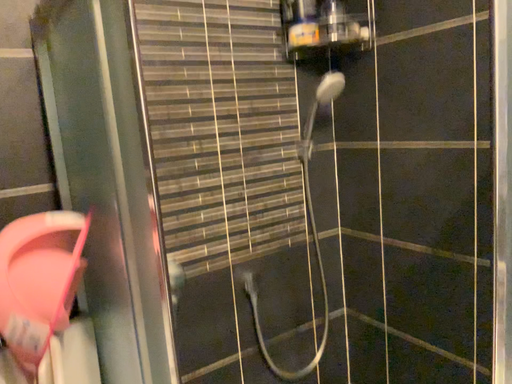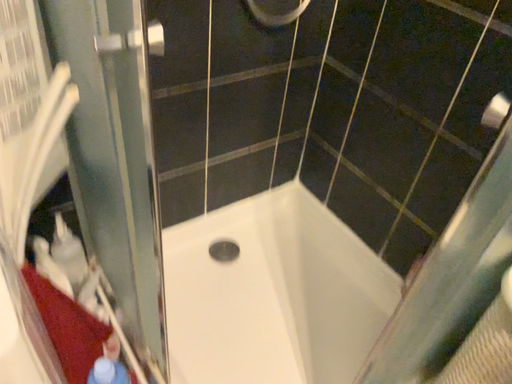
Question: How did the camera likely rotate when shooting the video?

Choices:
 (A) rotated upward
 (B) rotated downward

Answer: (B)